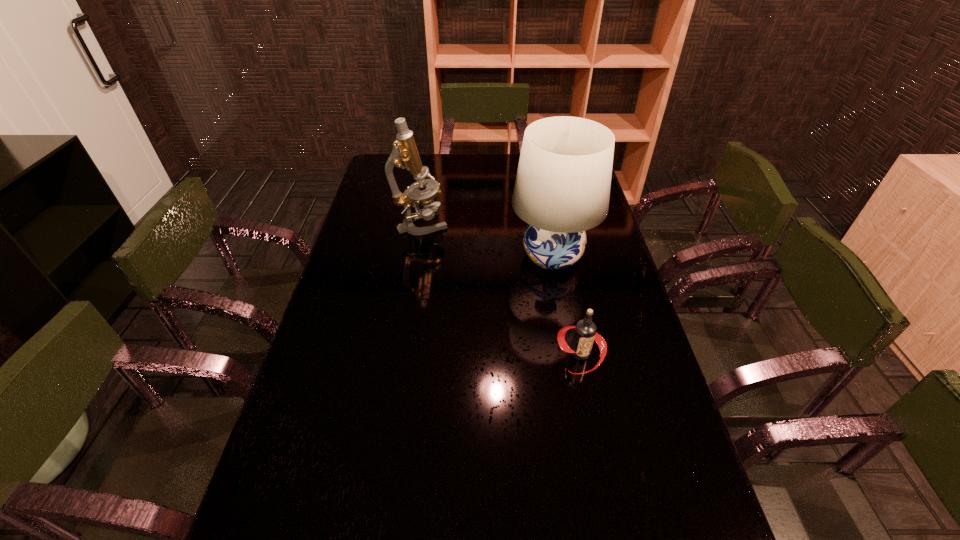
Identify which object is located as the nearest to the nearest object. Please provide its 2D coordinates. Your answer should be formatted as a tuple, i.e. [(x, y)], where the tuple contains the x and y coordinates of a point satisfying the conditions above.

[(562, 188)]